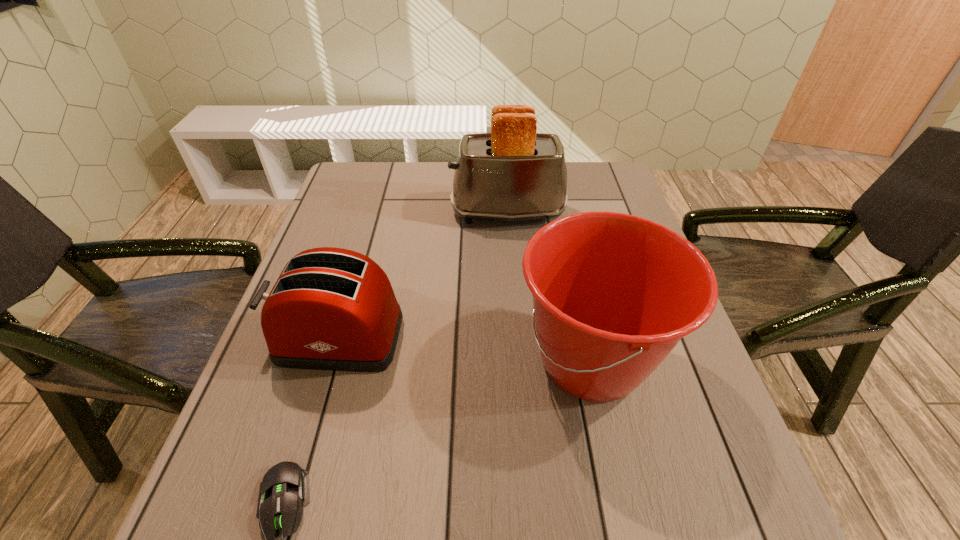
What are the coordinates of `the taller toaster` in the screenshot? It's located at (512, 174).

Locate an element on the screen. Image resolution: width=960 pixels, height=540 pixels. the farthest object is located at coordinates (512, 174).

Locate an element on the screen. bucket is located at coordinates (613, 293).

Locate an element on the screen. the second shortest object is located at coordinates tap(334, 309).

Identify the location of the left toaster. The height and width of the screenshot is (540, 960). (334, 309).

This screenshot has height=540, width=960. Identify the location of free region located on the side of the farther toaster with the control lever. (366, 212).

Image resolution: width=960 pixels, height=540 pixels. I want to click on vacant region located on the side of the farther toaster with the control lever, so click(x=380, y=212).

This screenshot has width=960, height=540. Identify the location of free space located on the side of the farther toaster with the control lever. (422, 212).

Locate an element on the screen. The height and width of the screenshot is (540, 960). vacant space located 0.350m with the handle attached to the rim of the bucket is located at coordinates (340, 361).

What are the coordinates of `vacant space located 0.230m with the handle attached to the rim of the bucket` in the screenshot? It's located at (400, 361).